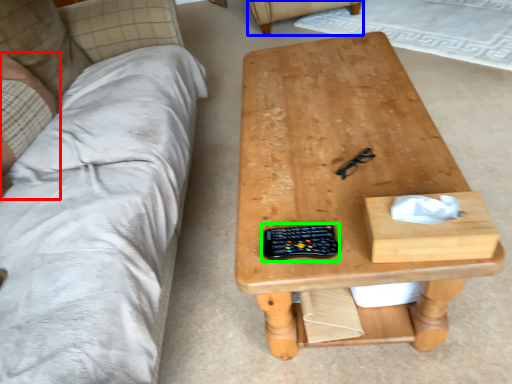
Question: Based on their relative distances, which object is nearer to person (highlighted by a red box)? Choose from armchair (highlighted by a blue box) and control (highlighted by a green box).

Choices:
 (A) armchair
 (B) control

Answer: (B)